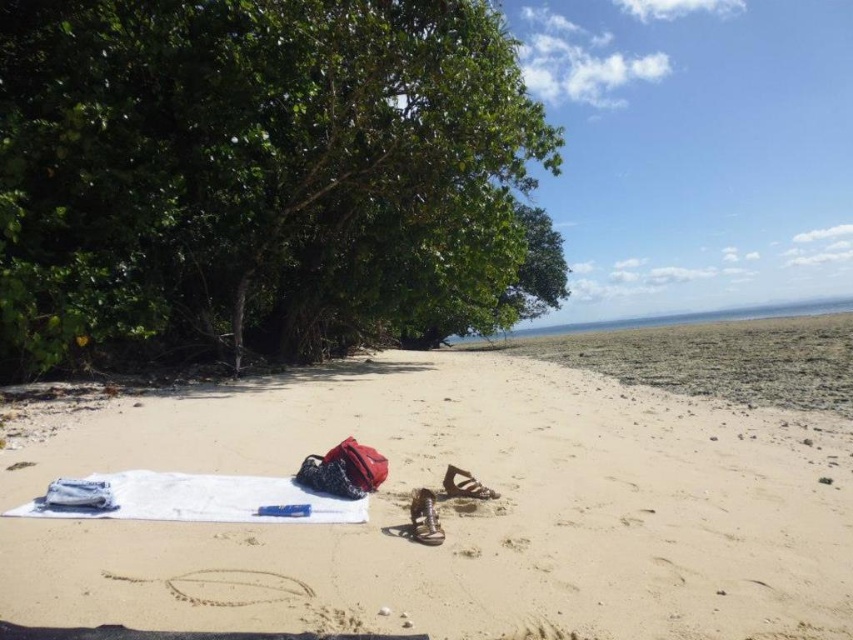
Question: Is green leafy tree at left behind white cotton towel at lower left?

Choices:
 (A) no
 (B) yes

Answer: (B)

Question: Among these points, which one is farthest from the camera?

Choices:
 (A) (361, 424)
 (B) (148, 508)
 (C) (497, 173)

Answer: (C)

Question: Which point is closer to the camera?

Choices:
 (A) (276, 481)
 (B) (508, 68)
 (C) (303, 394)

Answer: (A)

Question: Observing the image, what is the correct spatial positioning of white sand at center in reference to green leafy tree at left?

Choices:
 (A) below
 (B) above

Answer: (A)

Question: Which object appears farthest from the camera in this image?

Choices:
 (A) green leafy tree at left
 (B) white sand at center

Answer: (A)

Question: Can you confirm if white sand at center is smaller than green leafy tree at left?

Choices:
 (A) yes
 (B) no

Answer: (A)